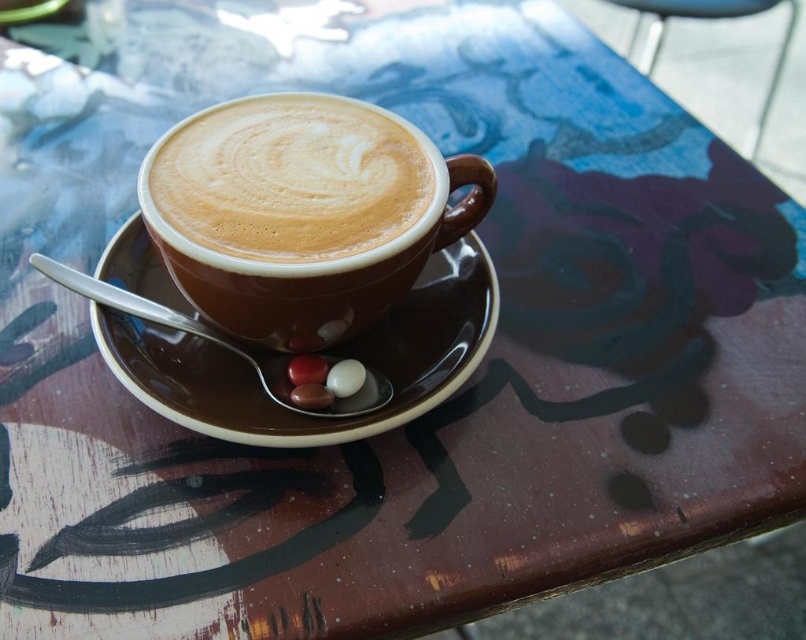
You are a barista who needs to determine if the cappuccino foam at center can fit entirely on the brown ceramic saucer at center without spilling. Based on their sizes, what do you think?

The cappuccino foam at center is not as tall as the brown ceramic saucer at center, so the foam can fit entirely on the saucer without spilling.

Looking at this image, you are a barista trying to place a new spoon on the table without touching the cappuccino foam at center or the brown ceramic saucer at center. Where should you put it?

The cappuccino foam at center is above the brown ceramic saucer at center, so placing the spoon on the table surface below the saucer would avoid contact with both.

You are a barista trying to determine if the cappuccino foam at center can fit entirely on the brown ceramic saucer at center. Based on their thickness, can the foam be placed on the saucer without spilling?

The cappuccino foam at center is thinner than the brown ceramic saucer at center, so it can fit on the saucer without spilling.